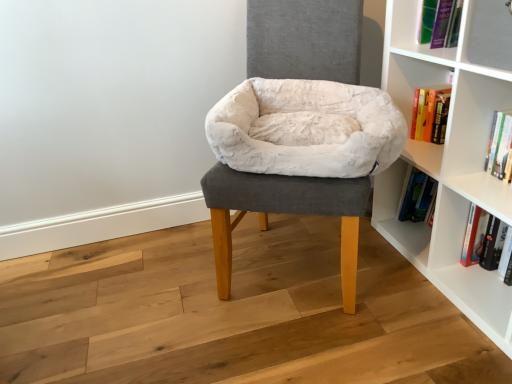
At what (x,y) coordinates should I click in order to perform the action: click on free space in front of white plush pet bed at center. Please return your answer as a coordinate pair (x, y). The width and height of the screenshot is (512, 384). Looking at the image, I should click on (331, 346).